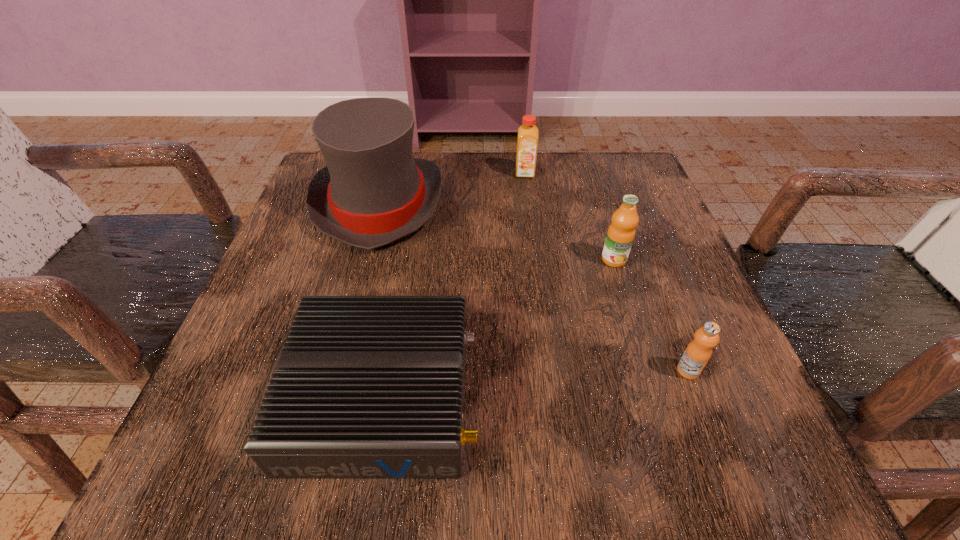
This screenshot has width=960, height=540. Identify the location of vacant area between the nearest orange juice and the dress hat. (534, 287).

The image size is (960, 540). In order to click on free spot between the rightmost object and the second object from right to left in this screenshot , I will do `click(651, 315)`.

The width and height of the screenshot is (960, 540). I want to click on empty space between the shortest object and the rightmost object, so click(536, 383).

At what (x,y) coordinates should I click in order to perform the action: click on empty location between the third object from left to right and the dress hat. Please return your answer as a coordinate pair (x, y). Looking at the image, I should click on (452, 188).

Where is `free spot between the shortest object and the nearest orange juice`? free spot between the shortest object and the nearest orange juice is located at coordinates pos(536,383).

Locate an element on the screen. The image size is (960, 540). free space between the farthest orange juice and the shortest object is located at coordinates (454, 285).

I want to click on object identified as the fourth closest to the rightmost object, so click(x=527, y=143).

You are a GUI agent. You are given a task and a screenshot of the screen. Output one action in this format:
    pyautogui.click(x=<x>, y=<y>)
    Task: Click on the fourth closest object to the rightmost object
    This screenshot has height=540, width=960.
    Given the screenshot: What is the action you would take?
    pyautogui.click(x=527, y=143)

Select which orange juice is the closest to the nearest orange juice. Please provide its 2D coordinates. Your answer should be formatted as a tuple, i.e. [(x, y)], where the tuple contains the x and y coordinates of a point satisfying the conditions above.

[(621, 232)]

Where is `orange juice that is the closest to the router`? orange juice that is the closest to the router is located at coordinates (621, 232).